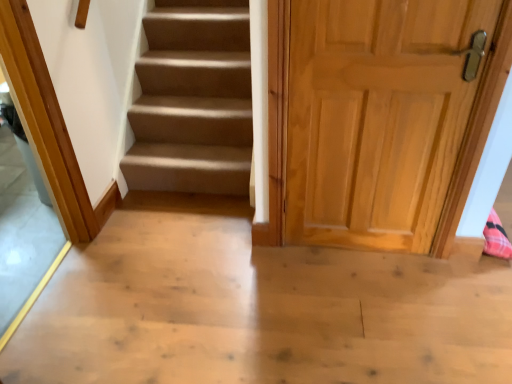
I want to click on vacant region to the right of transparent glass door at left, so click(x=141, y=287).